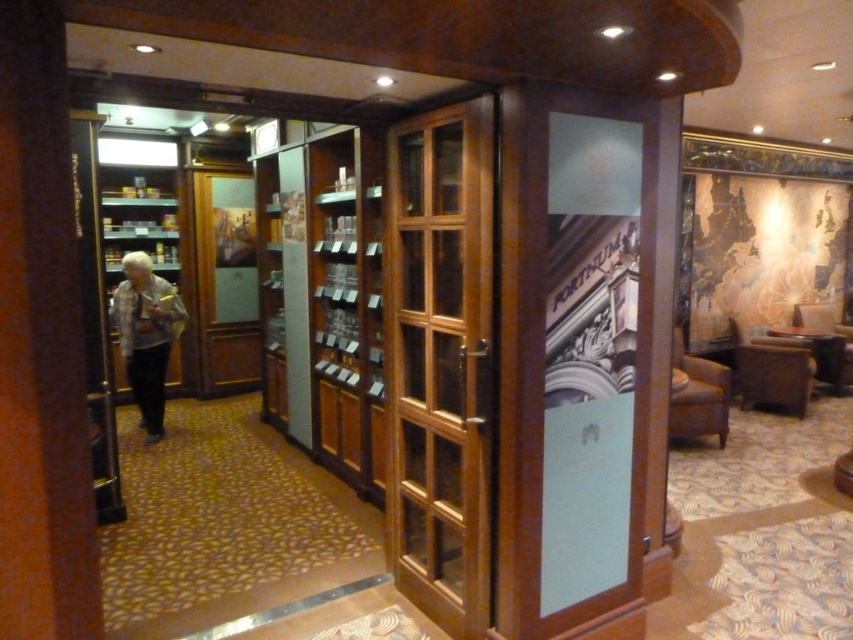
Can you confirm if mahogany wood glass door at center is positioned to the left of gray fabric jacket at left?

No, mahogany wood glass door at center is not to the left of gray fabric jacket at left.

Can you confirm if mahogany wood glass door at center is wider than gray fabric jacket at left?

No, mahogany wood glass door at center is not wider than gray fabric jacket at left.

The width and height of the screenshot is (853, 640). I want to click on mahogany wood glass door at center, so click(440, 362).